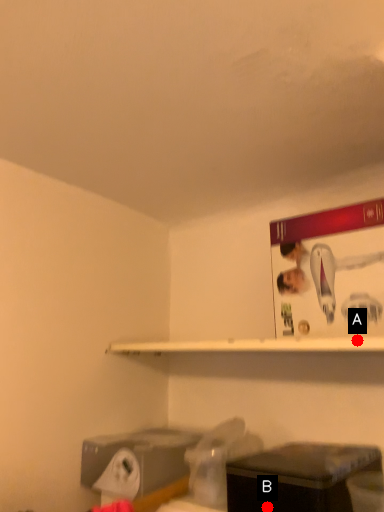
Question: Two points are circled on the image, labeled by A and B beside each circle. Which point is closer to the camera taking this photo?

Choices:
 (A) A is closer
 (B) B is closer

Answer: (A)